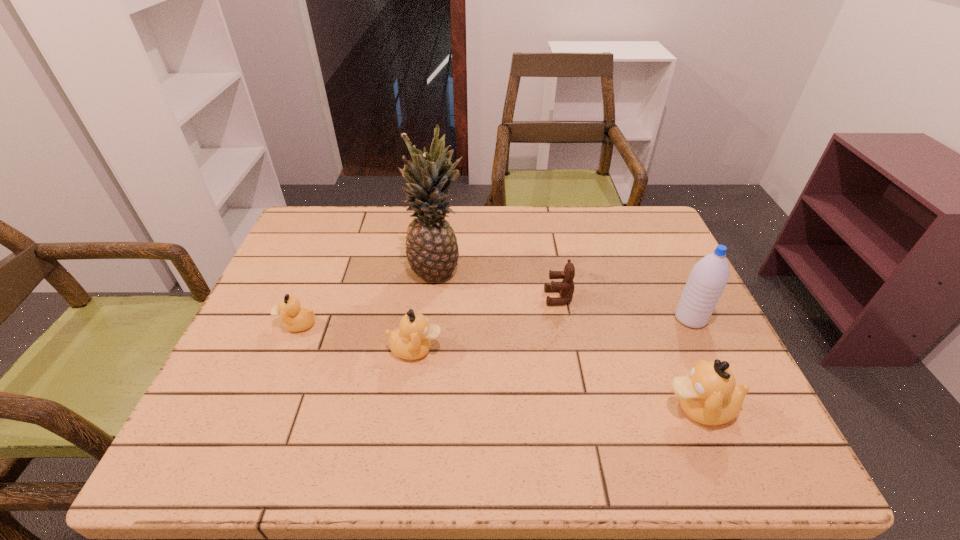
You are a GUI agent. You are given a task and a screenshot of the screen. Output one action in this format:
    pyautogui.click(x=<x>, y=<y>)
    Task: Click on the leftmost object
    The width and height of the screenshot is (960, 540).
    Given the screenshot: What is the action you would take?
    pyautogui.click(x=295, y=318)

What are the coordinates of `the leftmost duckling` in the screenshot? It's located at (295, 318).

The width and height of the screenshot is (960, 540). I want to click on the second duckling from right to left, so click(x=411, y=341).

What are the coordinates of `the rightmost duckling` in the screenshot? It's located at (709, 395).

The image size is (960, 540). Find the location of `the nearest duckling`. the nearest duckling is located at coordinates (709, 395).

Find the location of a particular element. The width and height of the screenshot is (960, 540). the tallest object is located at coordinates (432, 251).

Identify the location of the third object from right to left. (566, 288).

The width and height of the screenshot is (960, 540). I want to click on the fifth shortest object, so click(x=708, y=278).

Find the location of `free location located on the face of the shortest duckling`. free location located on the face of the shortest duckling is located at coordinates (252, 324).

Where is `vacant point located on the face of the second shortest duckling`? vacant point located on the face of the second shortest duckling is located at coordinates (598, 349).